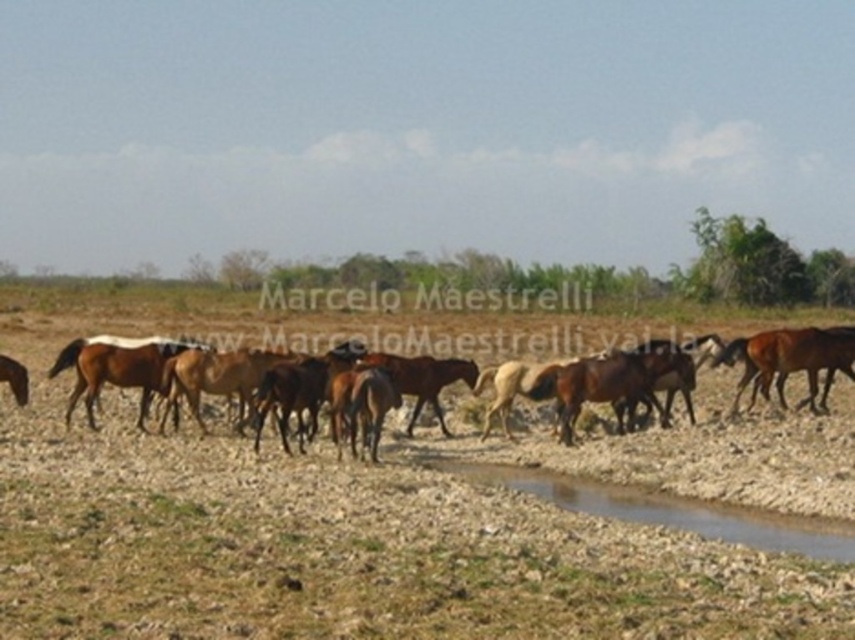
Is brown glossy horse at right smaller than brown glossy horse at left?

Incorrect, brown glossy horse at right is not smaller in size than brown glossy horse at left.

Between point (743, 385) and point (98, 390), which one is positioned in front?

Positioned in front is point (98, 390).

At what (x,y) coordinates should I click in order to perform the action: click on brown glossy horse at right. Please return your answer as a coordinate pair (x, y). The height and width of the screenshot is (640, 855). Looking at the image, I should click on (788, 360).

Between point (652, 508) and point (765, 397), which one is positioned in front?

Positioned in front is point (652, 508).

This screenshot has height=640, width=855. Find the location of `brown gravel puddle at lower center`. brown gravel puddle at lower center is located at coordinates (668, 509).

Between brown gravel puddle at lower center and brown glossy horse at left, which one is positioned lower?

brown gravel puddle at lower center is below.

Can you confirm if brown gravel puddle at lower center is positioned to the right of brown glossy horse at left?

A: Indeed, brown gravel puddle at lower center is positioned on the right side of brown glossy horse at left.

Is point (842, 557) more distant than point (109, 376)?

No, (842, 557) is in front of (109, 376).

The image size is (855, 640). Identify the location of brown gravel puddle at lower center. (668, 509).